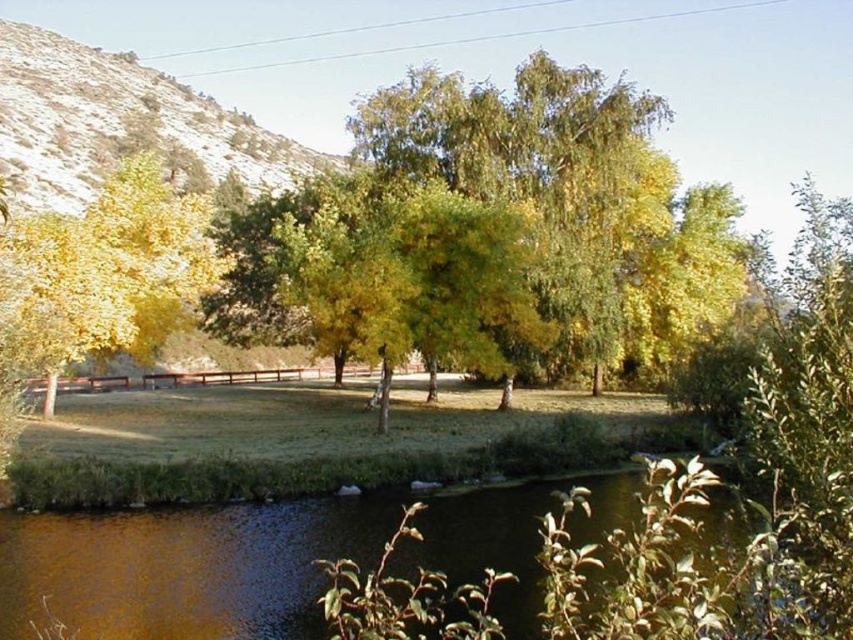
Can you confirm if brown liquid water at lower center is positioned to the right of yellow leafy tree at left?

Indeed, brown liquid water at lower center is positioned on the right side of yellow leafy tree at left.

This screenshot has height=640, width=853. Describe the element at coordinates (184, 568) in the screenshot. I see `brown liquid water at lower center` at that location.

Image resolution: width=853 pixels, height=640 pixels. Find the location of `brown liquid water at lower center`. brown liquid water at lower center is located at coordinates (184, 568).